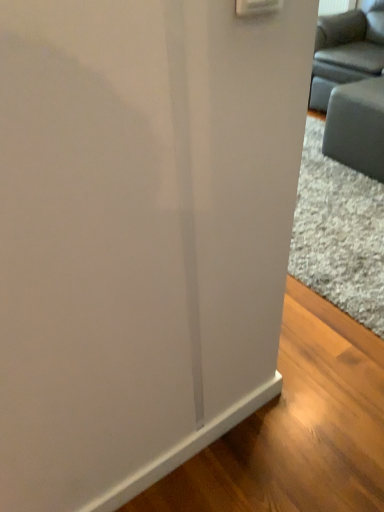
Question: In terms of size, does matte gray couch at upper right appear bigger or smaller than gray fabric couch at right?

Choices:
 (A) big
 (B) small

Answer: (A)

Question: Considering the positions of matte gray couch at upper right and gray fabric couch at right in the image, is matte gray couch at upper right wider or thinner than gray fabric couch at right?

Choices:
 (A) thin
 (B) wide

Answer: (B)

Question: Is point (327, 59) closer or farther from the camera than point (354, 137)?

Choices:
 (A) farther
 (B) closer

Answer: (A)

Question: From a real-world perspective, relative to matte gray couch at upper right, is gray fabric couch at right vertically above or below?

Choices:
 (A) below
 (B) above

Answer: (A)

Question: Is gray fabric couch at right wider or thinner than matte gray couch at upper right?

Choices:
 (A) thin
 (B) wide

Answer: (A)

Question: Relative to matte gray couch at upper right, is gray fabric couch at right in front or behind?

Choices:
 (A) front
 (B) behind

Answer: (A)

Question: Is gray fabric couch at right taller or shorter than matte gray couch at upper right?

Choices:
 (A) short
 (B) tall

Answer: (A)